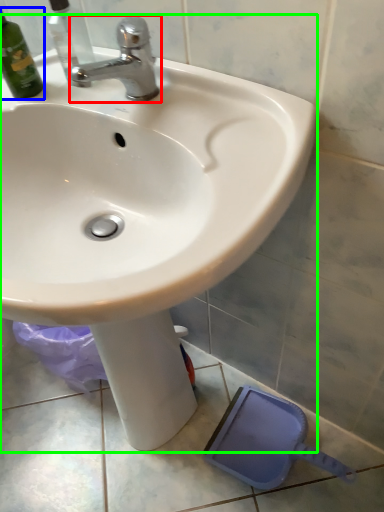
Question: Estimate the real-world distances between objects in this image. Which object is farther from tap (highlighted by a red box), bottle (highlighted by a blue box) or sink (highlighted by a green box)?

Choices:
 (A) bottle
 (B) sink

Answer: (B)